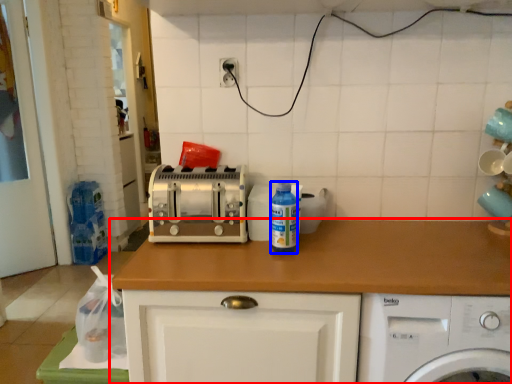
Question: Which of the following is the farthest to the observer, countertop (highlighted by a red box) or bottle (highlighted by a blue box)?

Choices:
 (A) countertop
 (B) bottle

Answer: (B)